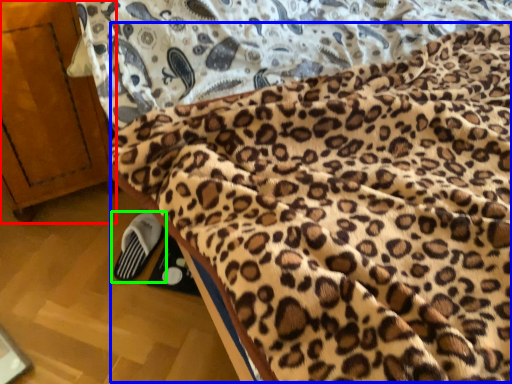
Question: Which is nearer to the furniture (highlighted by a red box)? blanket (highlighted by a blue box) or footwear (highlighted by a green box).

Choices:
 (A) blanket
 (B) footwear

Answer: (B)